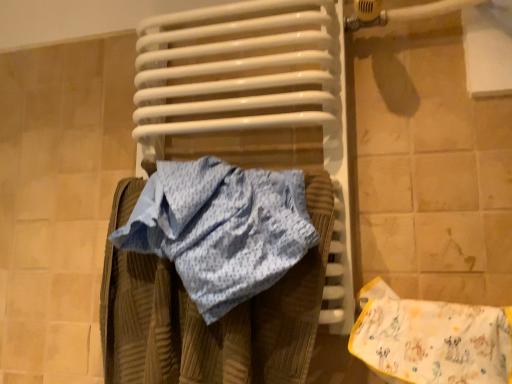
Question: Visually, is yellow cotton bib at lower right positioned to the left or to the right of white glossy radiator at center?

Choices:
 (A) right
 (B) left

Answer: (A)

Question: Looking at their shapes, would you say yellow cotton bib at lower right is wider or thinner than white glossy radiator at center?

Choices:
 (A) thin
 (B) wide

Answer: (A)

Question: Is yellow cotton bib at lower right taller or shorter than white glossy radiator at center?

Choices:
 (A) tall
 (B) short

Answer: (B)

Question: Does point (291, 94) appear closer or farther from the camera than point (398, 309)?

Choices:
 (A) farther
 (B) closer

Answer: (A)

Question: From the image's perspective, is white glossy radiator at center positioned above or below yellow cotton bib at lower right?

Choices:
 (A) below
 (B) above

Answer: (B)

Question: In terms of size, does white glossy radiator at center appear bigger or smaller than yellow cotton bib at lower right?

Choices:
 (A) small
 (B) big

Answer: (B)

Question: Is white glossy radiator at center wider or thinner than yellow cotton bib at lower right?

Choices:
 (A) thin
 (B) wide

Answer: (B)